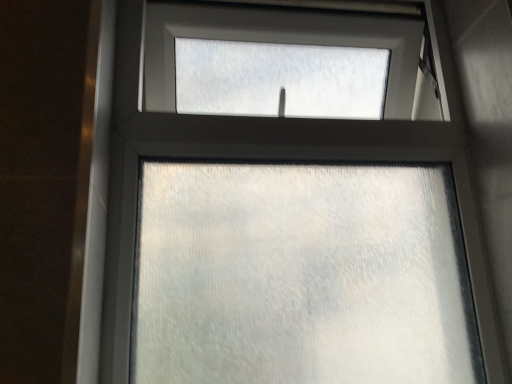
What do you see at coordinates (301, 275) in the screenshot? The image size is (512, 384). I see `frosted glass window at center` at bounding box center [301, 275].

Where is `frosted glass window at center`? This screenshot has width=512, height=384. frosted glass window at center is located at coordinates (301, 275).

Locate an element on the screen. The image size is (512, 384). frosted glass window at center is located at coordinates (301, 275).